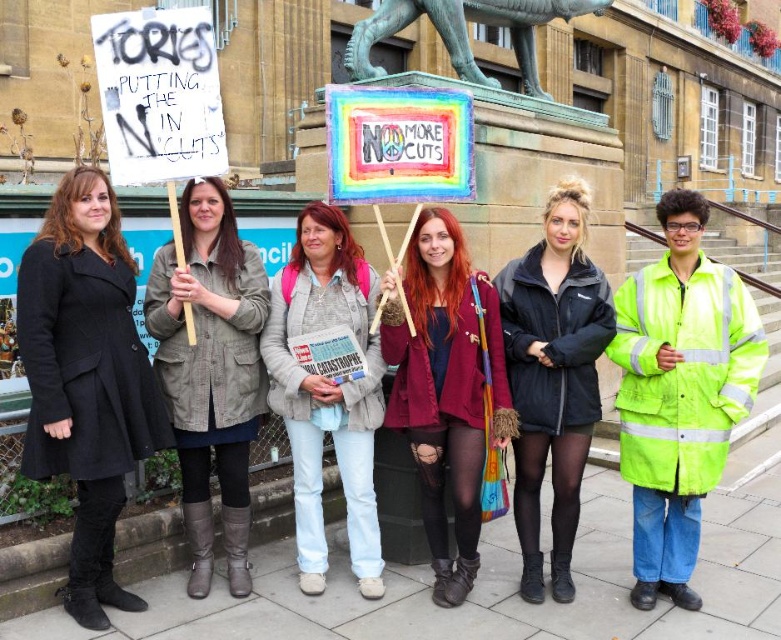
Between matte black coat at left and denim jacket at center, which one is positioned lower?

Positioned lower is matte black coat at left.

Describe the element at coordinates (86, 378) in the screenshot. The height and width of the screenshot is (640, 781). I see `matte black coat at left` at that location.

Locate an element on the screen. matte black coat at left is located at coordinates click(86, 378).

Which is above, matte gray jacket at center or black matte jacket at center?

Positioned higher is black matte jacket at center.

Does matte gray jacket at center have a lesser width compared to black matte jacket at center?

Incorrect, matte gray jacket at center's width is not less than black matte jacket at center's.

Identify the location of matte gray jacket at center. (211, 371).

Is black matte jacket at center below bronze statue at upper center?

Correct, black matte jacket at center is located below bronze statue at upper center.

Which is in front, point (562, 444) or point (515, 38)?

Positioned in front is point (562, 444).

Who is more distant from viewer, [526,461] or [571,12]?

The point [571,12] is behind.

What are the coordinates of `black matte jacket at center` in the screenshot? It's located at (553, 378).